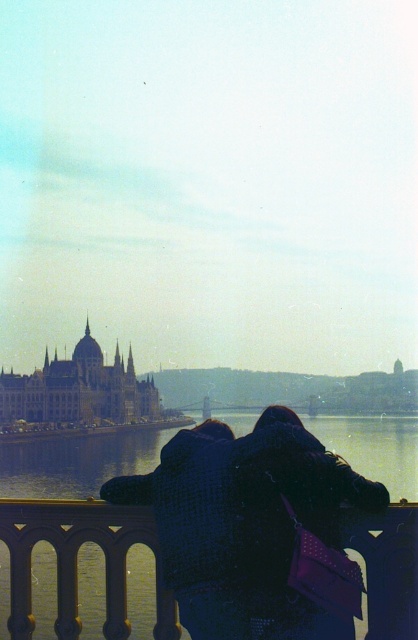
You are planning to take a photo of the golden stone palace at lower left and the clear water at lower center. Based on their sizes in the image, which one would you need to zoom in more to capture in detail?

The golden stone palace at lower left would require more zooming in because the clear water at lower center is wider than it, meaning the palace appears smaller in the image.

From the picture: You are standing at the viewpoint and want to take a photo of the golden stone palace at lower left and the matte gold dome at center. Which object should you focus on first if you want to capture both in the same frame without moving your camera?

The golden stone palace at lower left is below the matte gold dome at center, so you should focus on the golden stone palace at lower left first to ensure both are in frame.

You are standing on a bridge overlooking the clear water at lower center and the matte gold dome at center. Which object is nearer to you?

The clear water at lower center is closer to the viewer than the matte gold dome at center.